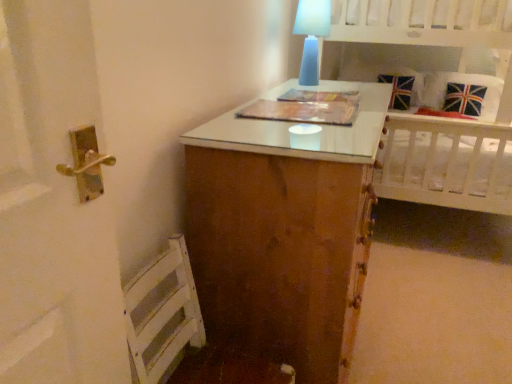
Question: Is white wooden bed at upper right thinner than blue frosted glass table lamp at upper center?

Choices:
 (A) no
 (B) yes

Answer: (A)

Question: Is the depth of white wooden bed at upper right less than that of blue frosted glass table lamp at upper center?

Choices:
 (A) no
 (B) yes

Answer: (B)

Question: From the image's perspective, does white wooden bed at upper right appear higher than blue frosted glass table lamp at upper center?

Choices:
 (A) no
 (B) yes

Answer: (A)

Question: Can you confirm if white wooden bed at upper right is shorter than blue frosted glass table lamp at upper center?

Choices:
 (A) no
 (B) yes

Answer: (A)

Question: Does white wooden bed at upper right have a smaller size compared to blue frosted glass table lamp at upper center?

Choices:
 (A) yes
 (B) no

Answer: (B)

Question: Does white wooden bed at upper right have a greater width compared to blue frosted glass table lamp at upper center?

Choices:
 (A) no
 (B) yes

Answer: (B)

Question: From the image's perspective, is union jack fabric pillow at upper right under white wooden bed at upper right?

Choices:
 (A) no
 (B) yes

Answer: (A)

Question: Are union jack fabric pillow at upper right and white wooden bed at upper right far apart?

Choices:
 (A) yes
 (B) no

Answer: (B)

Question: From a real-world perspective, is union jack fabric pillow at upper right positioned under white wooden bed at upper right based on gravity?

Choices:
 (A) yes
 (B) no

Answer: (A)

Question: Is union jack fabric pillow at upper right positioned with its back to white wooden bed at upper right?

Choices:
 (A) no
 (B) yes

Answer: (B)

Question: Does union jack fabric pillow at upper right have a greater width compared to white wooden bed at upper right?

Choices:
 (A) yes
 (B) no

Answer: (B)

Question: Is union jack fabric pillow at upper right bigger than white wooden bed at upper right?

Choices:
 (A) no
 (B) yes

Answer: (A)

Question: Considering the relative sizes of union jack fabric pillow at upper right and blue frosted glass table lamp at upper center in the image provided, is union jack fabric pillow at upper right bigger than blue frosted glass table lamp at upper center?

Choices:
 (A) no
 (B) yes

Answer: (B)